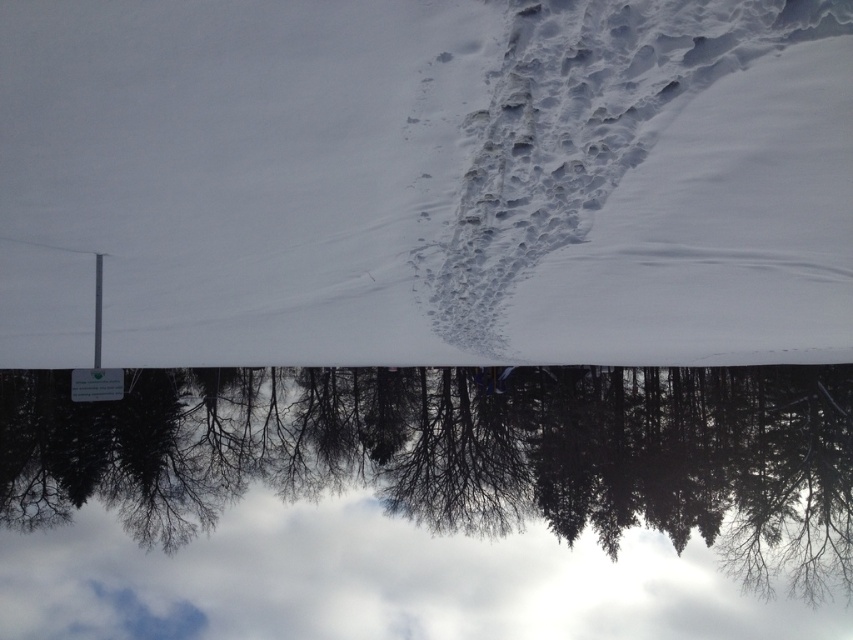
Is white powdery snow at center further to the viewer compared to silvery metallic trees at center?

No.

Is white powdery snow at center to the right of silvery metallic trees at center from the viewer's perspective?

Correct, you'll find white powdery snow at center to the right of silvery metallic trees at center.

Does point (125, 108) come behind point (302, 474)?

That is False.

Where is `white powdery snow at center`? white powdery snow at center is located at coordinates (425, 180).